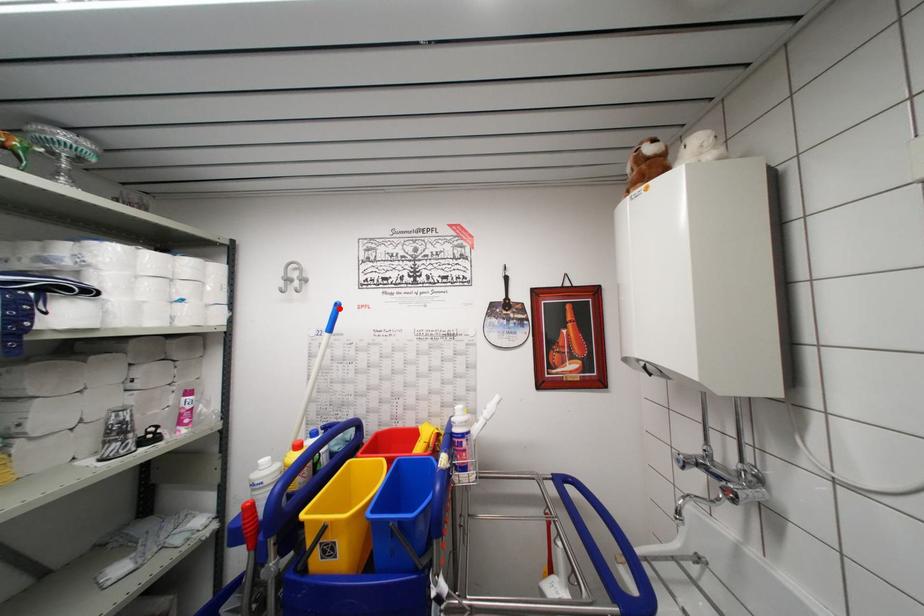
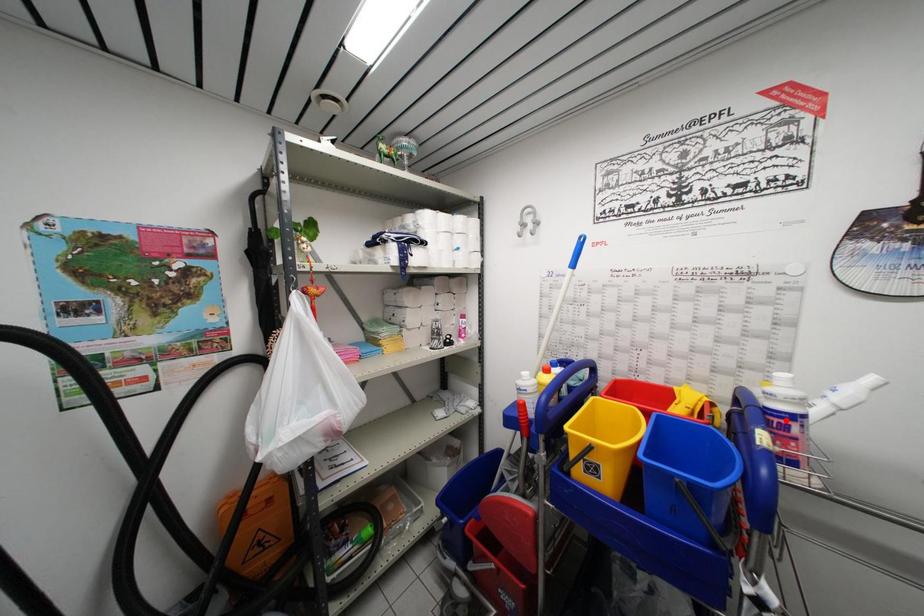
I am providing you with two images of the same scene from different viewpoints. A red point is marked on the first image and another point is marked on the second image. Is the marked point in image1 the same physical position as the marked point in image2?

No